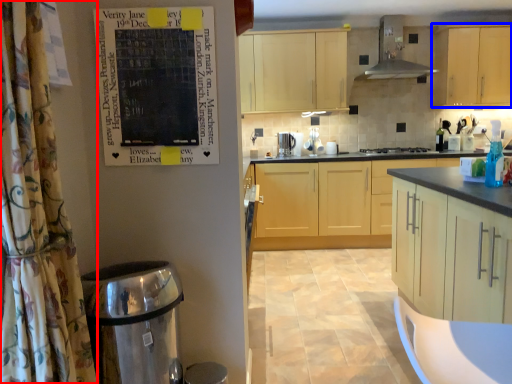
Question: Which object appears closest to the camera in this image, shower curtain (highlighted by a red box) or cabinetry (highlighted by a blue box)?

Choices:
 (A) shower curtain
 (B) cabinetry

Answer: (A)